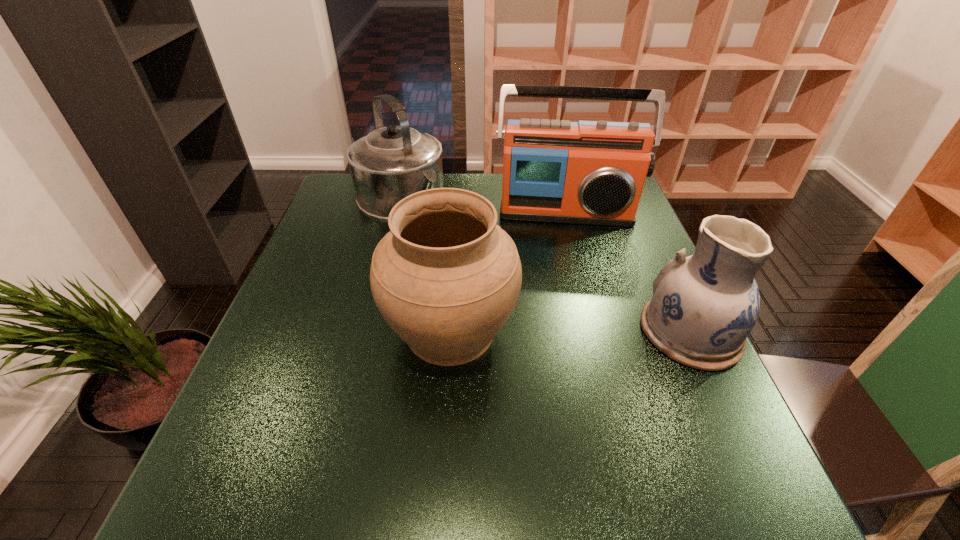
I want to click on vacant area situated 0.160m on the front-facing side of the radio receiver, so click(564, 266).

Locate an element on the screen. This screenshot has width=960, height=540. vacant region located on the front-facing side of the radio receiver is located at coordinates (565, 300).

Where is `kettle located in the far edge section of the desktop`? kettle located in the far edge section of the desktop is located at coordinates (390, 163).

Image resolution: width=960 pixels, height=540 pixels. In order to click on radio receiver situated at the far edge in this screenshot , I will do `click(588, 172)`.

This screenshot has width=960, height=540. Identify the location of object present at the left edge. (390, 163).

Locate an element on the screen. The height and width of the screenshot is (540, 960). pottery that is at the right edge is located at coordinates (704, 306).

Where is `radio receiver that is at the right edge`? radio receiver that is at the right edge is located at coordinates (588, 172).

Where is `object at the far left corner`? The width and height of the screenshot is (960, 540). object at the far left corner is located at coordinates (390, 163).

This screenshot has height=540, width=960. What are the coordinates of `object that is at the far right corner` in the screenshot? It's located at pos(588,172).

This screenshot has width=960, height=540. Identify the location of free space at the far edge. (469, 187).